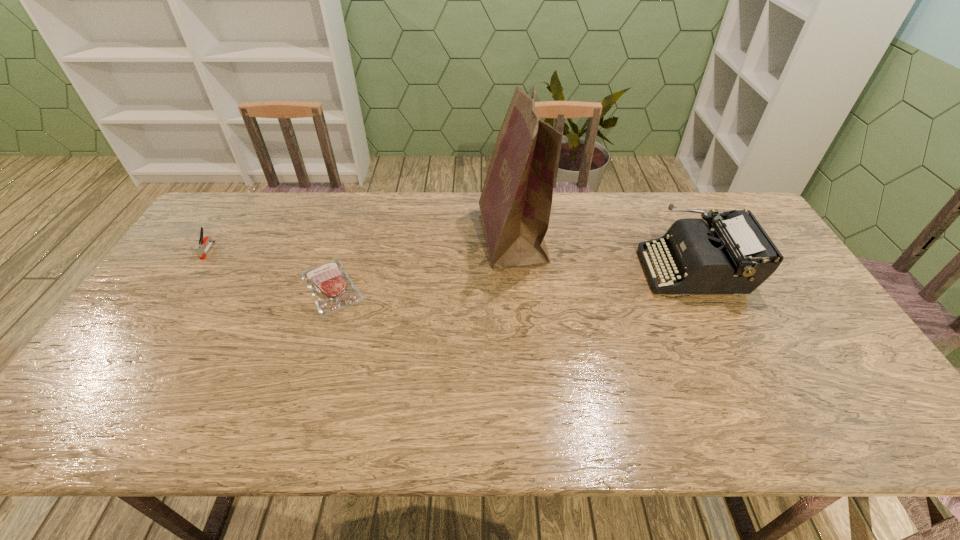
Image resolution: width=960 pixels, height=540 pixels. In order to click on the tallest object in this screenshot , I will do `click(515, 204)`.

Locate an element on the screen. grocery bag is located at coordinates (515, 204).

At what (x,y) coordinates should I click in order to perform the action: click on typewriter. Please return your answer as a coordinate pair (x, y). The height and width of the screenshot is (540, 960). Looking at the image, I should click on (736, 257).

Locate an element on the screen. This screenshot has width=960, height=540. the rightmost object is located at coordinates (736, 257).

In order to click on the second shortest object in this screenshot , I will do `click(199, 249)`.

Find the location of a particular element. This screenshot has width=960, height=540. stapler is located at coordinates (199, 249).

Locate an element on the screen. steak is located at coordinates (332, 289).

Identify the location of the shortest object. (332, 289).

The width and height of the screenshot is (960, 540). Identify the location of vacant space located on the front-facing side of the grocery bag. (463, 237).

At what (x,y) coordinates should I click in order to perform the action: click on free space located on the front-facing side of the grocery bag. Please return your answer as a coordinate pair (x, y). Looking at the image, I should click on (386, 237).